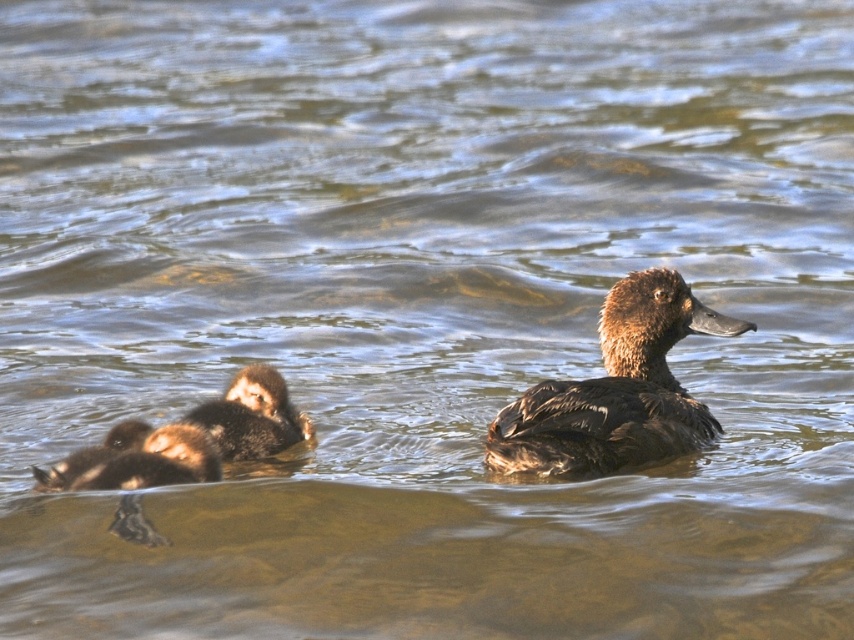
You are a photographer trying to capture the brown matte duck at center and the brown fuzzy duckling at lower left in a single frame. Considering their sizes, which one will occupy more space in the photo?

The brown matte duck at center will occupy more space in the photo because its width surpasses that of the brown fuzzy duckling at lower left.

You are observing a group of ducks in a pond. You see a brown matte duck at center and a brown fuzzy duckling at lower left. Which one is positioned higher in the image?

The brown matte duck at center is positioned higher than the brown fuzzy duckling at lower left in the image.